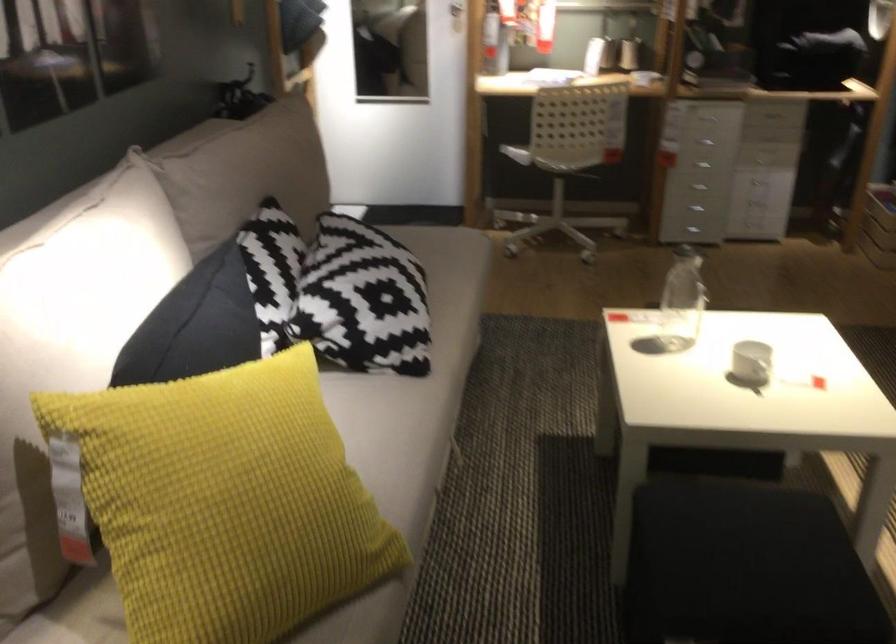
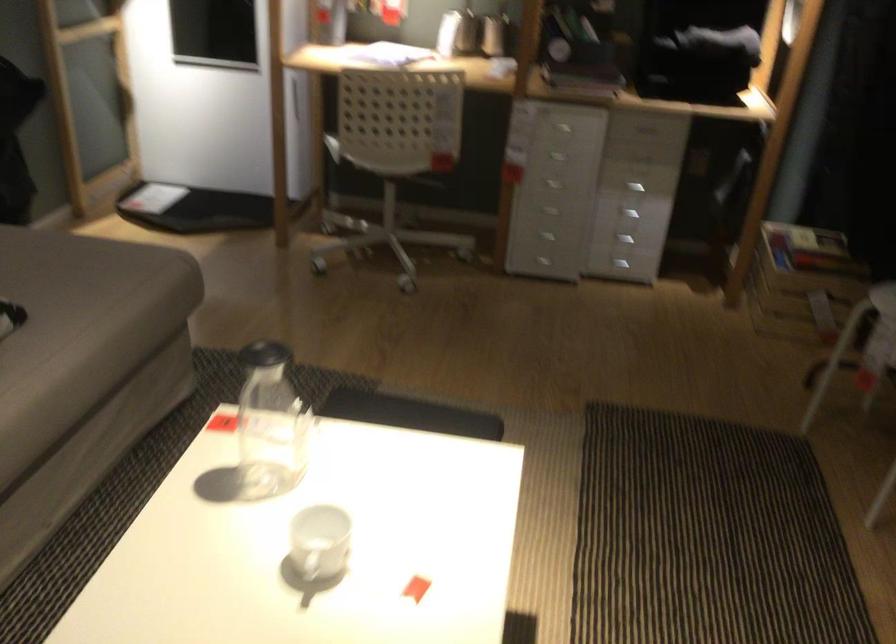
In the second image, find the point that corresponds to [748,379] in the first image.

(320, 542)